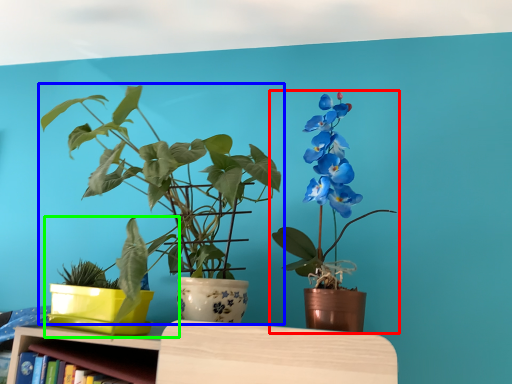
Question: Which is nearer to the houseplant (highlighted by a red box)? houseplant (highlighted by a blue box) or houseplant (highlighted by a green box).

Choices:
 (A) houseplant
 (B) houseplant

Answer: (A)